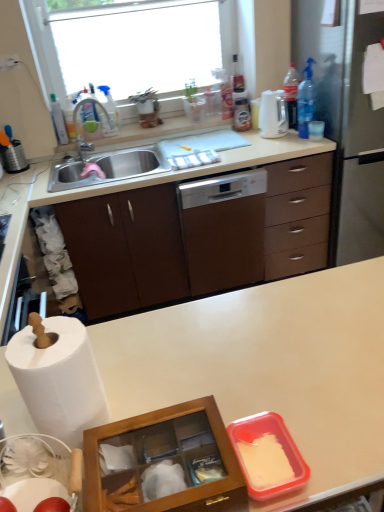
Locate an element on the screen. The width and height of the screenshot is (384, 512). unoccupied space behind transparent plastic spray bottle at upper left, positioned as the 3th bottle in right-to-left order is located at coordinates (x=123, y=129).